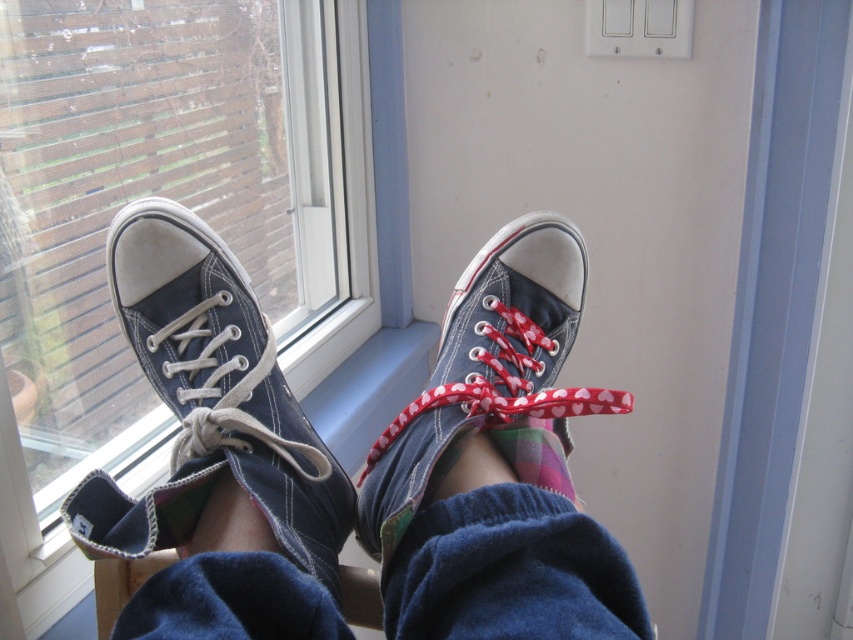
What do you see at coordinates (173, 198) in the screenshot? I see `transparent glass window at left` at bounding box center [173, 198].

Is transparent glass window at left wider than dark blue canvas shoe at center?

Correct, the width of transparent glass window at left exceeds that of dark blue canvas shoe at center.

Describe the element at coordinates (173, 198) in the screenshot. The width and height of the screenshot is (853, 640). I see `transparent glass window at left` at that location.

At what (x,y) coordinates should I click in order to perform the action: click on transparent glass window at left. Please return your answer as a coordinate pair (x, y). This screenshot has width=853, height=640. Looking at the image, I should click on (173, 198).

Which is in front, point (111, 243) or point (527, 426)?

Point (527, 426) is more forward.

Which of these two, dark blue canvas shoe at center or matte blue canvas shoe at center, stands shorter?

Standing shorter between the two is dark blue canvas shoe at center.

Who is more distant from viewer, (277, 442) or (544, 273)?

The point (544, 273) is behind.

You are a GUI agent. You are given a task and a screenshot of the screen. Output one action in this format:
    pyautogui.click(x=<x>, y=<y>)
    Task: Click on the dark blue canvas shoe at center
    Image resolution: width=853 pixels, height=640 pixels.
    Given the screenshot: What is the action you would take?
    pyautogui.click(x=216, y=396)

Does matte blue sneakers at center lie behind matte blue canvas shoe at center?

That is False.

Is matte blue sneakers at center wider than matte blue canvas shoe at center?

Yes.

What do you see at coordinates (367, 461) in the screenshot?
I see `matte blue sneakers at center` at bounding box center [367, 461].

Where is `matte blue sneakers at center`? matte blue sneakers at center is located at coordinates (367, 461).